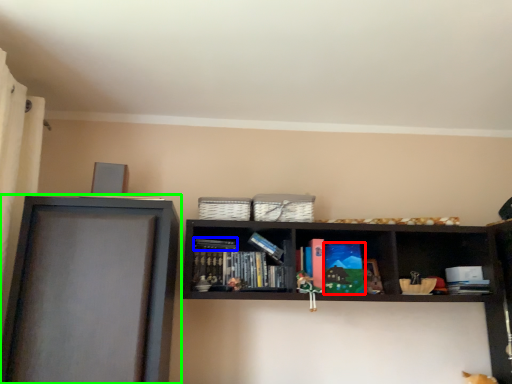
Question: Which object is positioned farthest from paperback book (highlighted by a red box)? Select from book (highlighted by a blue box) and shelf (highlighted by a green box).

Choices:
 (A) book
 (B) shelf

Answer: (B)